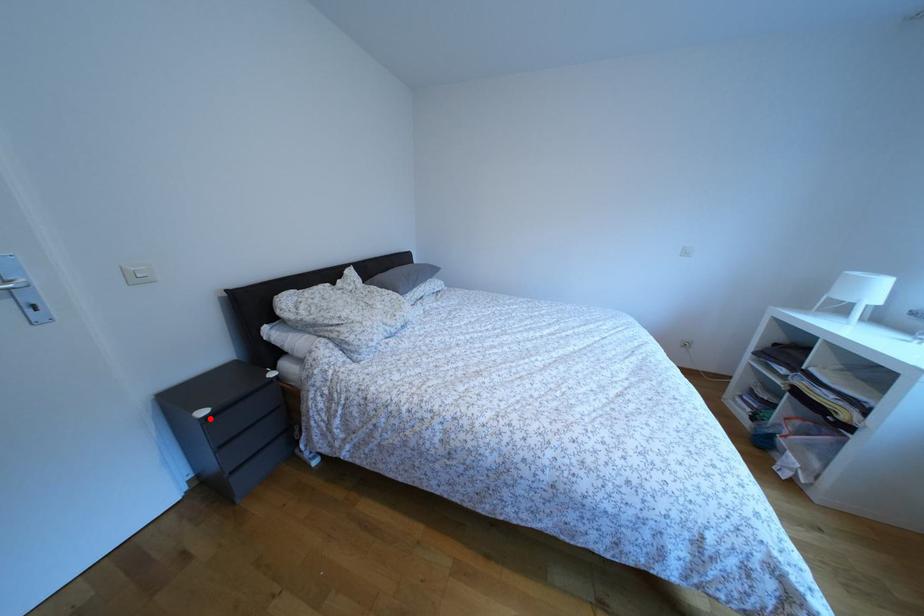
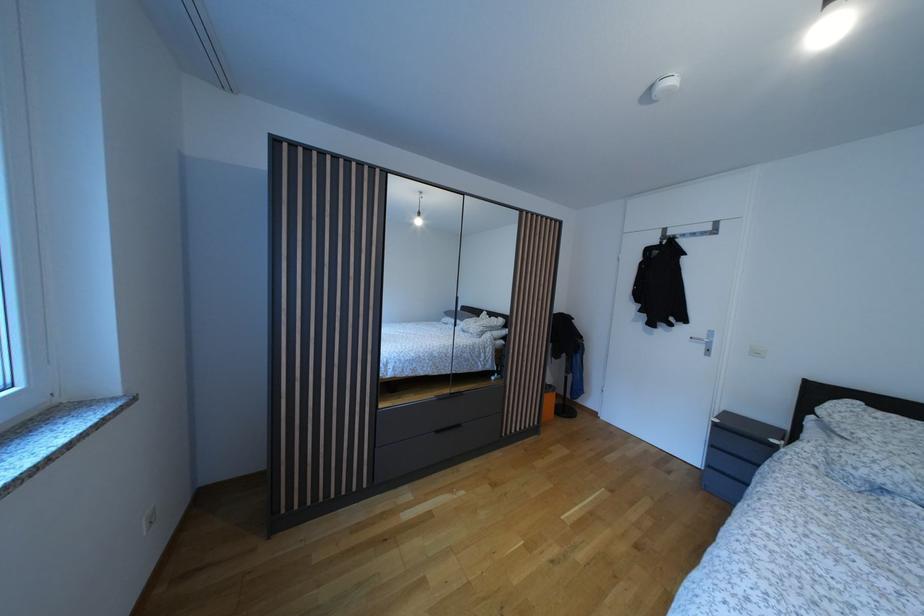
Locate, in the second image, the point that corresponds to the highlighted location in the first image.

(723, 427)